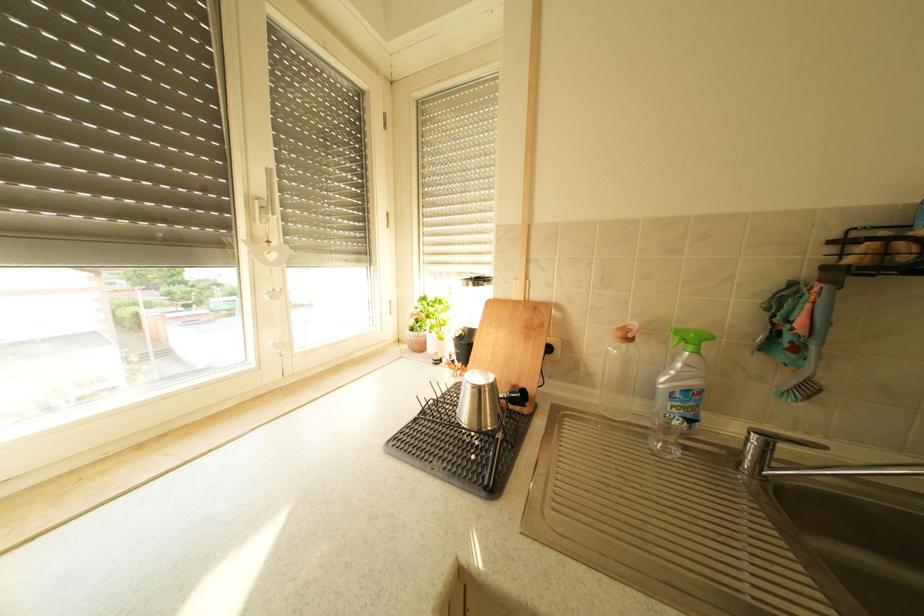
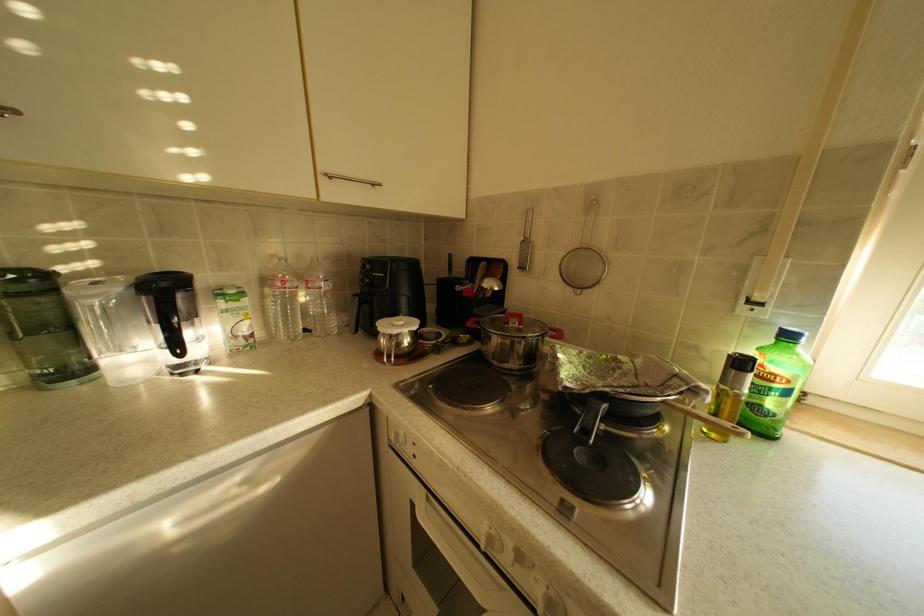
First-person continuous shooting, in which direction is the camera rotating?

The rotation direction of the camera is left-down.